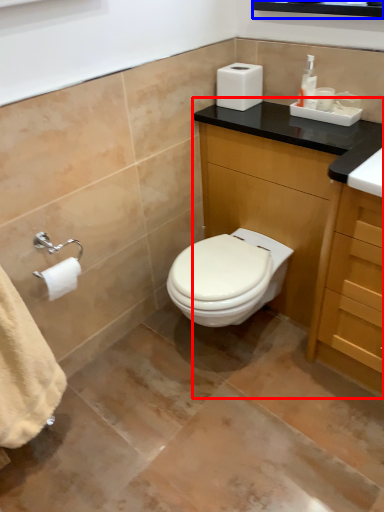
Question: Which object appears farthest to the camera in this image, bathroom cabinet (highlighted by a red box) or medicine cabinet (highlighted by a blue box)?

Choices:
 (A) bathroom cabinet
 (B) medicine cabinet

Answer: (A)